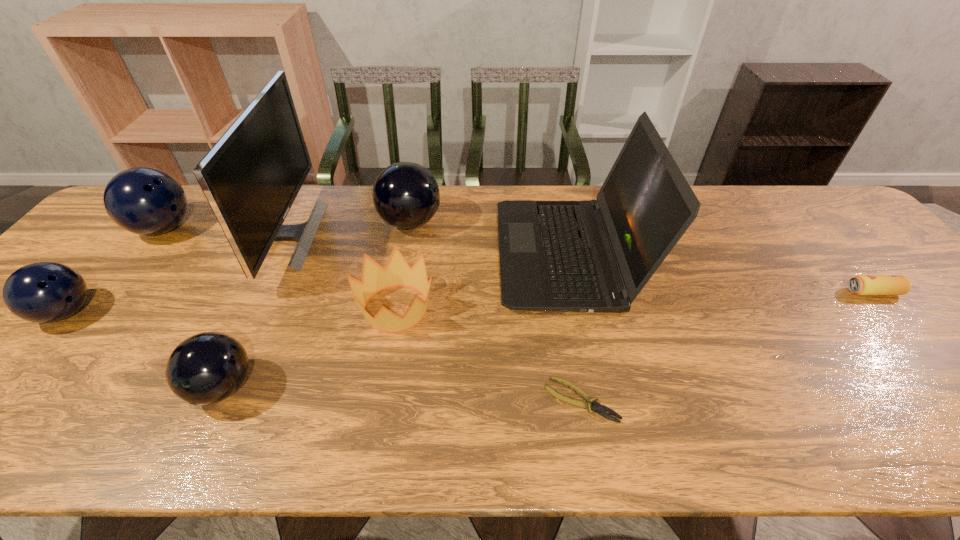
Identify the location of pliers positioned at the near edge. (597, 407).

Identify the location of object that is positioned at the right edge. Image resolution: width=960 pixels, height=540 pixels. (861, 284).

Locate an element on the screen. Image resolution: width=960 pixels, height=540 pixels. object that is at the far left corner is located at coordinates (145, 201).

This screenshot has width=960, height=540. I want to click on vacant space at the far edge, so click(x=367, y=202).

In the image, there is a desktop. At what (x,y) coordinates should I click in order to perform the action: click on blank space at the right edge. Please return your answer as a coordinate pair (x, y). Looking at the image, I should click on (x=959, y=350).

Image resolution: width=960 pixels, height=540 pixels. In the image, there is a desktop. In order to click on vacant space at the far right corner in this screenshot , I will do `click(814, 210)`.

I want to click on unoccupied area between the monitor and the smaller blue bowling ball, so click(177, 274).

The height and width of the screenshot is (540, 960). I want to click on free space between the gold crown and the third bowling ball from left to right, so click(310, 348).

Locate an element on the screen. The image size is (960, 540). vacant space in between the left black bowling ball and the second nearest bowling ball is located at coordinates pos(145,349).

Where is `free space between the shortest object and the rightmost object`? This screenshot has width=960, height=540. free space between the shortest object and the rightmost object is located at coordinates (727, 346).